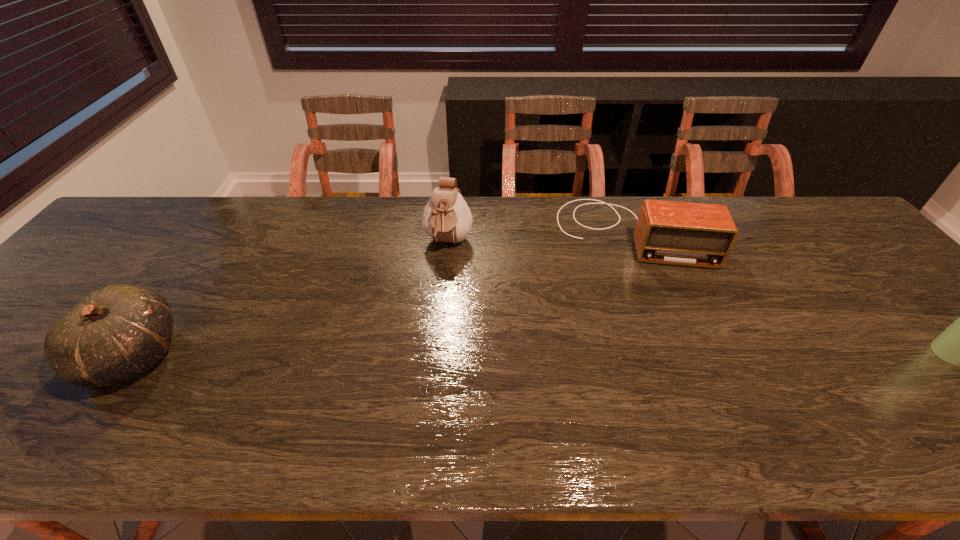
Identify the location of vacant space located on the front-facing side of the radio receiver. The image size is (960, 540). (642, 305).

This screenshot has width=960, height=540. I want to click on pouch present at the far edge, so click(x=446, y=218).

Find the location of a particular element. radio receiver that is at the far edge is located at coordinates (667, 232).

Find the location of `object positioned at the near edge`. object positioned at the near edge is located at coordinates (116, 333).

The width and height of the screenshot is (960, 540). In the image, there is a desktop. What are the coordinates of `blank space at the far edge` in the screenshot? It's located at (340, 205).

Find the location of a particular element. free space at the near edge of the desktop is located at coordinates (807, 407).

In the image, there is a desktop. In order to click on vacant space at the far left corner in this screenshot , I will do `click(152, 203)`.

The height and width of the screenshot is (540, 960). In the image, there is a desktop. Identify the location of vacant space at the far right corner. (840, 223).

You are a GUI agent. You are given a task and a screenshot of the screen. Output one action in this format:
    pyautogui.click(x=<x>, y=<y>)
    Task: Click on the empty space that is in between the leftmost object and the shortest object
    
    Given the screenshot: What is the action you would take?
    pyautogui.click(x=383, y=294)

Where is `free spot between the shortest object and the leftmost object`? free spot between the shortest object and the leftmost object is located at coordinates (383, 294).